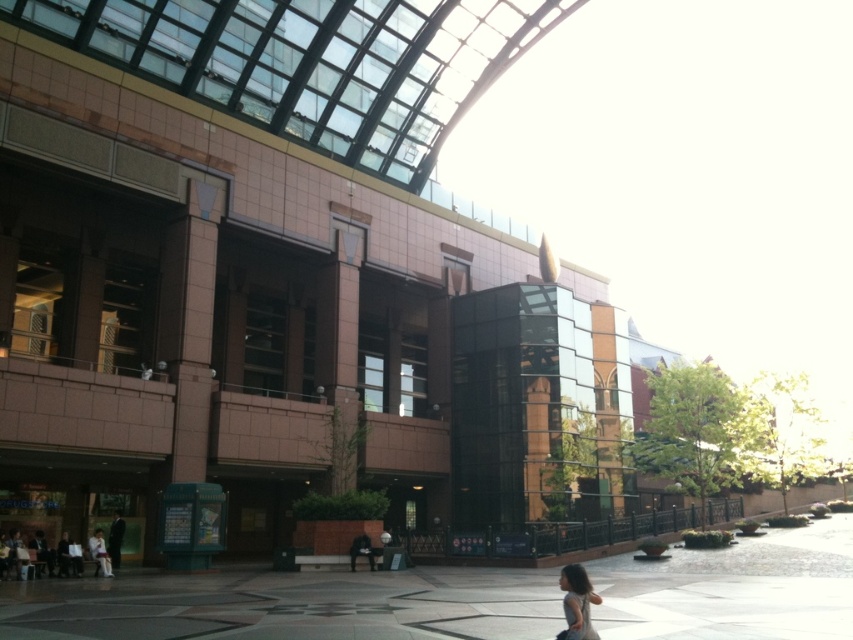
Question: Which point appears closest to the camera in this image?

Choices:
 (A) (103, 566)
 (B) (572, 589)
 (C) (350, 586)

Answer: (B)

Question: Considering the real-world distances, which object is closest to the matte black dress at lower right?

Choices:
 (A) light beige fabric jacket at lower left
 (B) polished concrete pavement at lower center

Answer: (B)

Question: Is polished concrete pavement at lower center thinner than light beige fabric jacket at lower left?

Choices:
 (A) yes
 (B) no

Answer: (B)

Question: Which point appears farthest from the camera in this image?

Choices:
 (A) (799, 561)
 (B) (93, 557)

Answer: (B)

Question: Is polished concrete pavement at lower center to the left of matte black dress at lower right from the viewer's perspective?

Choices:
 (A) yes
 (B) no

Answer: (A)

Question: Observing the image, what is the correct spatial positioning of polished concrete pavement at lower center in reference to light beige fabric jacket at lower left?

Choices:
 (A) above
 (B) below

Answer: (A)